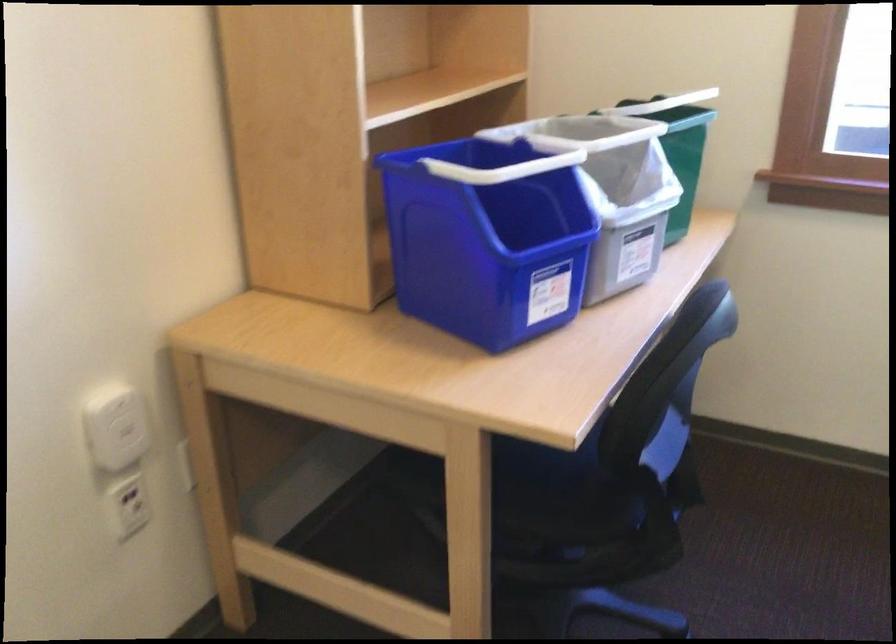
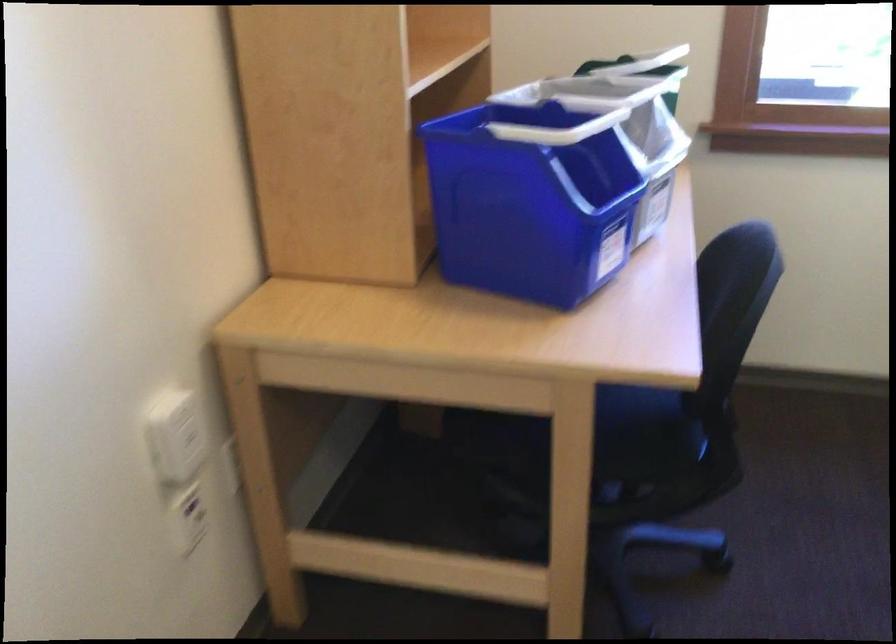
In the second image, find the point that corresponds to (x=547, y=524) in the first image.

(625, 469)